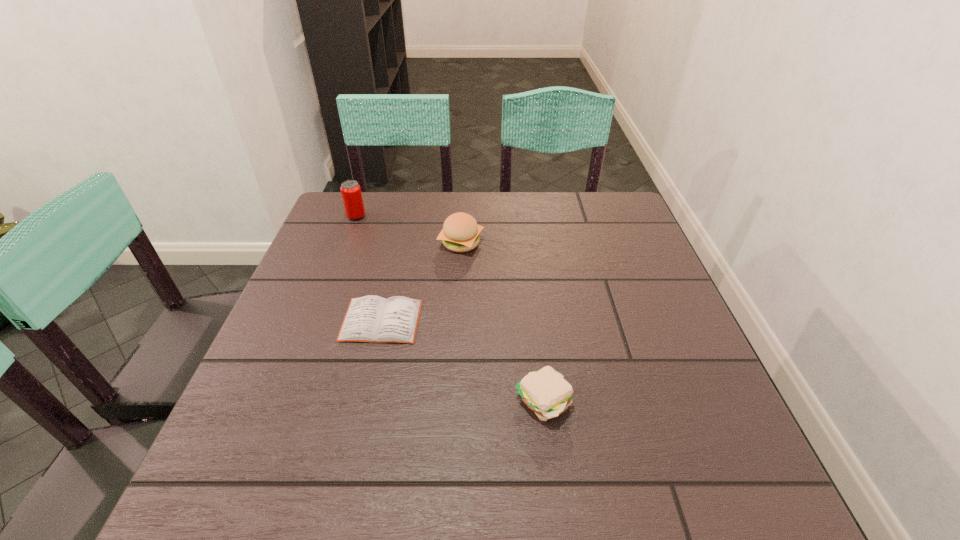
Locate an element on the screen. blank space at the right edge is located at coordinates (654, 370).

In the image, there is a desktop. Where is `free space at the far left corner`? free space at the far left corner is located at coordinates (373, 223).

Locate an element on the screen. The image size is (960, 540). vacant position at the far right corner of the desktop is located at coordinates (593, 207).

You are a GUI agent. You are given a task and a screenshot of the screen. Output one action in this format:
    pyautogui.click(x=<x>, y=<y>)
    Task: Click on the blank space at the near right corner of the desktop
    Image resolution: width=960 pixels, height=540 pixels.
    Given the screenshot: What is the action you would take?
    coord(738,499)

This screenshot has width=960, height=540. I want to click on vacant space that is in between the patty and the second nearest object, so click(462, 361).

Locate an element on the screen. The image size is (960, 540). vacant area that lies between the hamburger and the leftmost object is located at coordinates (409, 230).

At what (x,y) coordinates should I click in order to perform the action: click on free space between the farthest object and the diary. Please return your answer as a coordinate pair (x, y). Looking at the image, I should click on (369, 268).

The width and height of the screenshot is (960, 540). What are the coordinates of `free area in between the hamburger and the rightmost object` in the screenshot? It's located at (502, 322).

At what (x,y) coordinates should I click in order to perform the action: click on blank region between the leftmost object and the rightmost object. Please return your answer as a coordinate pair (x, y). The image size is (960, 540). Looking at the image, I should click on (449, 309).

This screenshot has width=960, height=540. I want to click on vacant area that lies between the second tallest object and the shortest object, so click(x=421, y=282).